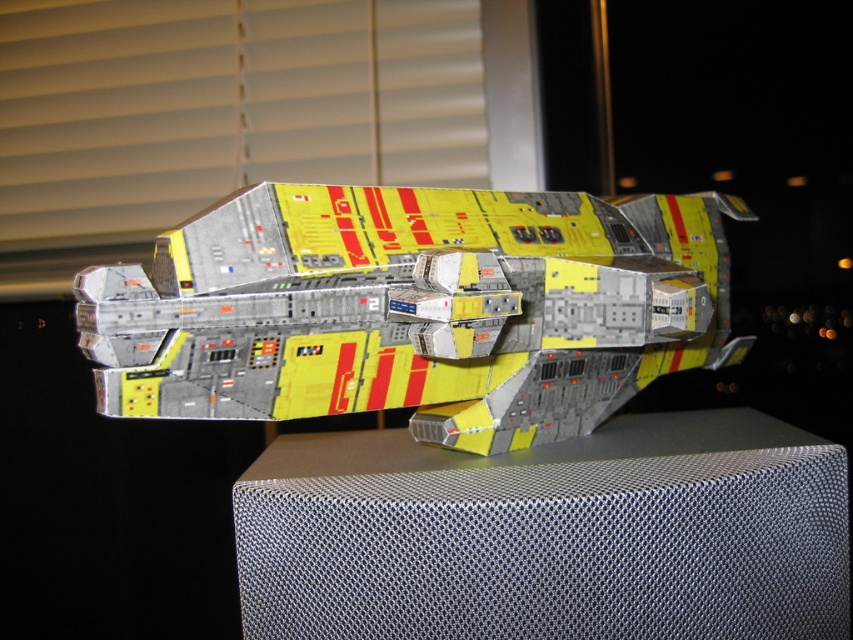
Question: Is yellow matte/model ship at center above metallic mesh table at center?

Choices:
 (A) no
 (B) yes

Answer: (B)

Question: Which object appears farthest from the camera in this image?

Choices:
 (A) yellow matte/model ship at center
 (B) metallic mesh table at center

Answer: (B)

Question: Which point is closer to the camera?

Choices:
 (A) (527, 285)
 (B) (461, 628)

Answer: (B)

Question: Can you confirm if yellow matte/model ship at center is positioned to the right of metallic mesh table at center?

Choices:
 (A) yes
 (B) no

Answer: (B)

Question: Can you confirm if yellow matte/model ship at center is positioned to the left of metallic mesh table at center?

Choices:
 (A) no
 (B) yes

Answer: (B)